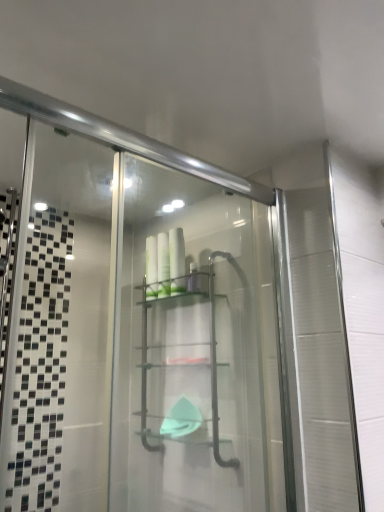
Question: From the image's perspective, does white glossy bottles at center, the 2th toiletry from the right, appear higher than clear plastic shelf at center?

Choices:
 (A) yes
 (B) no

Answer: (A)

Question: From a real-world perspective, is white glossy bottles at center, which is the first toiletry from left to right, located higher than clear plastic shelf at center?

Choices:
 (A) no
 (B) yes

Answer: (B)

Question: Is white glossy bottles at center, the 2th toiletry from the right, positioned in front of clear plastic shelf at center?

Choices:
 (A) yes
 (B) no

Answer: (B)

Question: From a real-world perspective, is white glossy bottles at center, which is the first toiletry from left to right, physically below clear plastic shelf at center?

Choices:
 (A) yes
 (B) no

Answer: (B)

Question: Considering the relative sizes of white glossy bottles at center, which is the first toiletry from left to right, and clear plastic shelf at center in the image provided, is white glossy bottles at center, which is the first toiletry from left to right, shorter than clear plastic shelf at center?

Choices:
 (A) yes
 (B) no

Answer: (A)

Question: Can you confirm if white glossy bottles at center, which is the first toiletry from left to right, is bigger than clear plastic shelf at center?

Choices:
 (A) no
 (B) yes

Answer: (A)

Question: Can you confirm if white glossy bottles at center, the 2th toiletry viewed from the left, is bigger than white glossy bottles at center, which is the first toiletry from left to right?

Choices:
 (A) no
 (B) yes

Answer: (B)

Question: From a real-world perspective, is white glossy bottles at center, the 2th toiletry viewed from the left, beneath white glossy bottles at center, the 2th toiletry from the right?

Choices:
 (A) no
 (B) yes

Answer: (A)

Question: From a real-world perspective, is white glossy bottles at center, the 2th toiletry viewed from the left, on white glossy bottles at center, the 2th toiletry from the right?

Choices:
 (A) no
 (B) yes

Answer: (B)

Question: Can you confirm if white glossy bottles at center, the 1th toiletry in the right-to-left sequence, is wider than white glossy bottles at center, which is the first toiletry from left to right?

Choices:
 (A) no
 (B) yes

Answer: (B)

Question: Is white glossy bottles at center, the 2th toiletry viewed from the left, oriented away from white glossy bottles at center, which is the first toiletry from left to right?

Choices:
 (A) yes
 (B) no

Answer: (B)

Question: Does white glossy bottles at center, the 1th toiletry in the right-to-left sequence, appear on the left side of white glossy bottles at center, which is the first toiletry from left to right?

Choices:
 (A) no
 (B) yes

Answer: (A)

Question: Considering the relative positions of white glossy bottles at center, the 1th toiletry in the right-to-left sequence, and clear plastic shelf at center in the image provided, is white glossy bottles at center, the 1th toiletry in the right-to-left sequence, in front of clear plastic shelf at center?

Choices:
 (A) yes
 (B) no

Answer: (B)